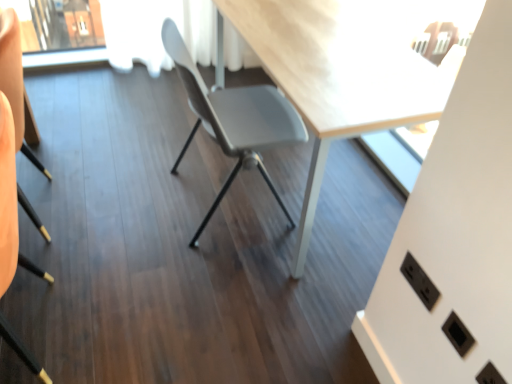
Question: Is black plastic electric outlet at lower right oriented towards black matte chair at lower left, the 1th chair viewed from the left?

Choices:
 (A) yes
 (B) no

Answer: (A)

Question: Considering the relative sizes of black plastic electric outlet at lower right and black matte chair at lower left, which appears as the second chair when viewed from the right, in the image provided, is black plastic electric outlet at lower right wider than black matte chair at lower left, which appears as the second chair when viewed from the right,?

Choices:
 (A) no
 (B) yes

Answer: (A)

Question: From a real-world perspective, is black plastic electric outlet at lower right on black matte chair at lower left, the 1th chair viewed from the left?

Choices:
 (A) no
 (B) yes

Answer: (B)

Question: Considering the relative sizes of black plastic electric outlet at lower right and black matte chair at lower left, the 1th chair viewed from the left, in the image provided, is black plastic electric outlet at lower right bigger than black matte chair at lower left, the 1th chair viewed from the left,?

Choices:
 (A) no
 (B) yes

Answer: (A)

Question: Is black plastic electric outlet at lower right not inside black matte chair at lower left, which appears as the second chair when viewed from the right?

Choices:
 (A) no
 (B) yes

Answer: (B)

Question: Is point (17, 79) positioned closer to the camera than point (282, 97)?

Choices:
 (A) farther
 (B) closer

Answer: (B)

Question: Is black matte chair at lower left, which appears as the second chair when viewed from the right, situated inside matte gray chair at center, which is the first chair from right to left, or outside?

Choices:
 (A) inside
 (B) outside

Answer: (B)

Question: From the image's perspective, relative to matte gray chair at center, the 2th chair viewed from the left, is black matte chair at lower left, which appears as the second chair when viewed from the right, above or below?

Choices:
 (A) below
 (B) above

Answer: (A)

Question: From a real-world perspective, relative to matte gray chair at center, which is the first chair from right to left, is black matte chair at lower left, which appears as the second chair when viewed from the right, vertically above or below?

Choices:
 (A) below
 (B) above

Answer: (B)

Question: Is matte gray chair at center, the 2th chair viewed from the left, bigger or smaller than black matte chair at lower left, the 1th chair viewed from the left?

Choices:
 (A) small
 (B) big

Answer: (B)

Question: Is matte gray chair at center, the 2th chair viewed from the left, spatially inside black matte chair at lower left, the 1th chair viewed from the left, or outside of it?

Choices:
 (A) outside
 (B) inside

Answer: (A)

Question: From a real-world perspective, relative to black matte chair at lower left, the 1th chair viewed from the left, is matte gray chair at center, which is the first chair from right to left, vertically above or below?

Choices:
 (A) below
 (B) above

Answer: (A)

Question: Does point (164, 21) appear closer or farther from the camera than point (22, 142)?

Choices:
 (A) closer
 (B) farther

Answer: (B)

Question: Considering the positions of black matte chair at lower left, which appears as the second chair when viewed from the right, and black plastic electric outlet at lower right in the image, is black matte chair at lower left, which appears as the second chair when viewed from the right, taller or shorter than black plastic electric outlet at lower right?

Choices:
 (A) tall
 (B) short

Answer: (A)

Question: From a real-world perspective, relative to black plastic electric outlet at lower right, is black matte chair at lower left, the 1th chair viewed from the left, vertically above or below?

Choices:
 (A) above
 (B) below

Answer: (B)